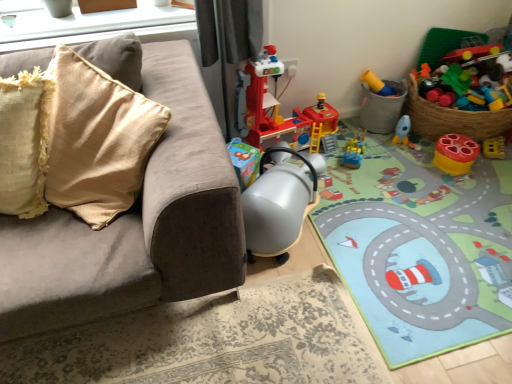
Find the location of a particular element. vacant space that is in between matte plastic rocket at lower right, which appears as the 3th toy when viewed from the right, and translucent plastic train at center, positioned as the second toy in left-to-right order is located at coordinates (383, 151).